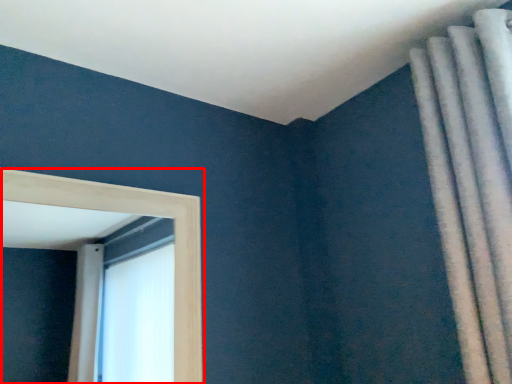
Question: In this image, where is window (annotated by the red box) located relative to curtain?

Choices:
 (A) left
 (B) right

Answer: (A)